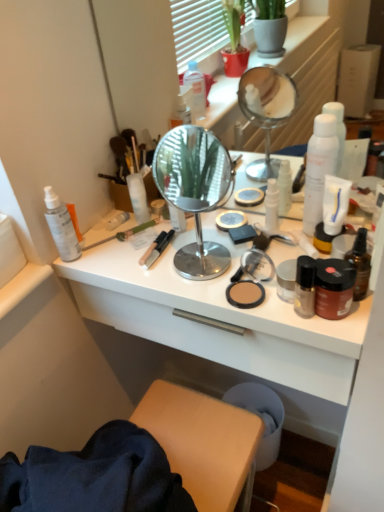
I want to click on vacant space to the left of matte gold jar at center right, which ranks as the eighth toiletry in left-to-right order, so click(238, 252).